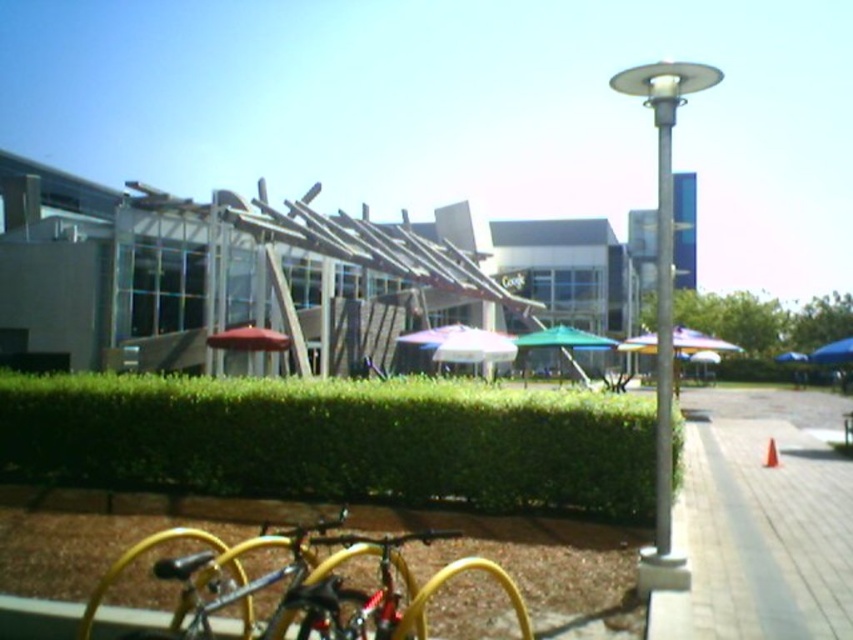
Question: Which object is closer to the camera taking this photo?

Choices:
 (A) red fabric umbrella at center
 (B) green leafy hedge at lower center
 (C) blue fabric umbrella at lower right

Answer: (B)

Question: Which point is farther from the camera taking this photo?

Choices:
 (A) (656, 260)
 (B) (241, 326)
 (C) (334, 628)

Answer: (A)

Question: Considering the relative positions of green leafy hedge at lower center and red fabric umbrella at center in the image provided, where is green leafy hedge at lower center located with respect to red fabric umbrella at center?

Choices:
 (A) above
 (B) below

Answer: (B)

Question: Where is green leafy hedge at lower center located in relation to blue fabric umbrella at lower right in the image?

Choices:
 (A) left
 (B) right

Answer: (A)

Question: Can you confirm if yellow matte bicycle at lower left is positioned below silver metallic pole at center-right?

Choices:
 (A) yes
 (B) no

Answer: (A)

Question: Which object is positioned farthest from the red fabric umbrella at center?

Choices:
 (A) blue fabric umbrella at lower right
 (B) silver metallic pole at center-right

Answer: (A)